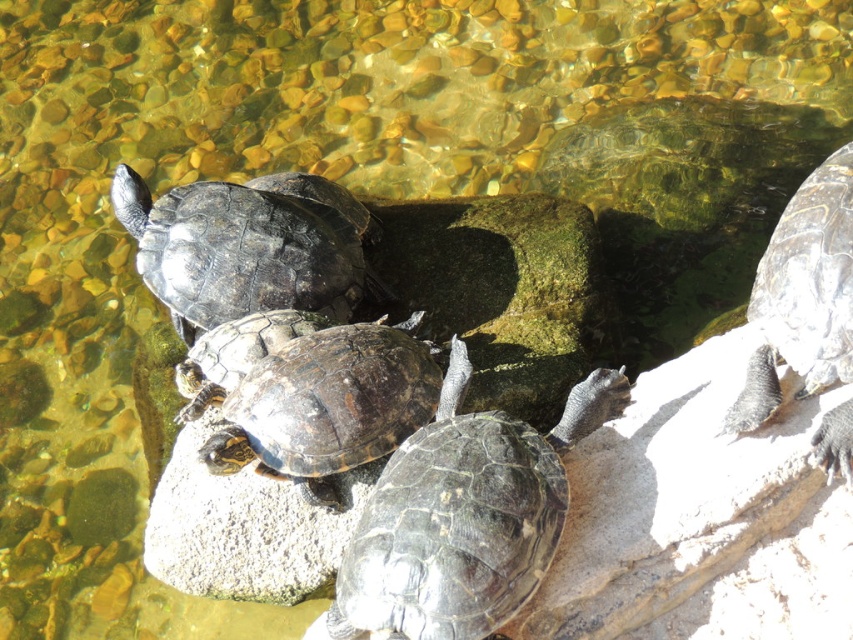
Question: Among these objects, which one is farthest from the camera?

Choices:
 (A) shiny dark brown tortoise at center
 (B) shiny dark green tortoise at right
 (C) shiny dark gray tortoise at center
 (D) shiny brown tortoise at center

Answer: (C)

Question: Which point appears closest to the camera in this image?

Choices:
 (A) (287, 364)
 (B) (184, 362)
 (C) (544, 534)
 (D) (340, 316)

Answer: (C)

Question: Does shiny dark gray tortoise at center have a larger size compared to shiny dark green tortoise at right?

Choices:
 (A) yes
 (B) no

Answer: (A)

Question: Does shiny dark gray tortoise at center have a greater width compared to shiny dark green tortoise at right?

Choices:
 (A) yes
 (B) no

Answer: (A)

Question: Which point is farther to the camera?

Choices:
 (A) (427, 532)
 (B) (845, 227)
 (C) (270, 301)
 (D) (270, 369)

Answer: (C)

Question: Can you confirm if shiny dark green tortoise at center is wider than shiny brown tortoise at center?

Choices:
 (A) yes
 (B) no

Answer: (A)